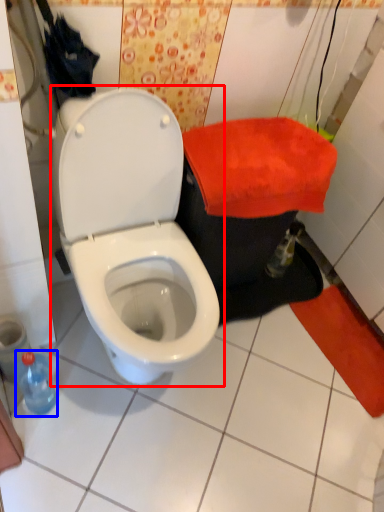
Question: Among these objects, which one is nearest to the camera, toilet (highlighted by a red box) or bottle (highlighted by a blue box)?

Choices:
 (A) toilet
 (B) bottle

Answer: (A)